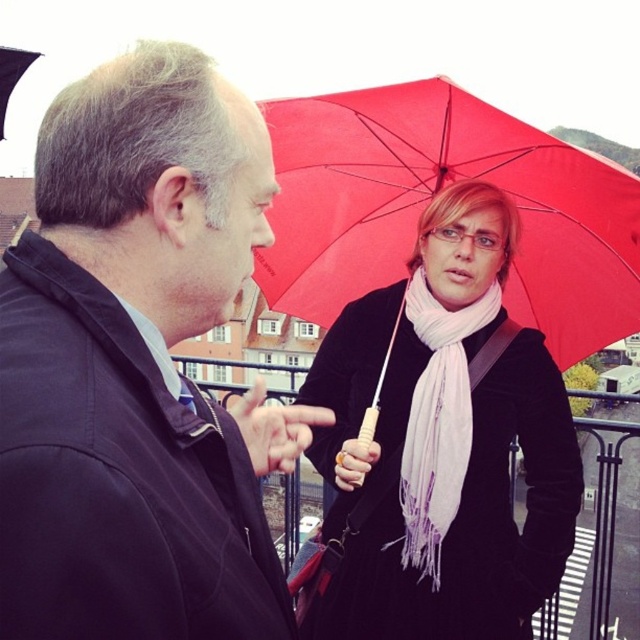
Describe the element at coordinates (138, 368) in the screenshot. This screenshot has width=640, height=640. I see `matte black jacket at left` at that location.

Who is positioned more to the left, matte black jacket at left or white soft scarf at center?

matte black jacket at left

Which is in front, point (8, 333) or point (451, 333)?

Positioned in front is point (8, 333).

At what (x,y) coordinates should I click in order to perform the action: click on matte black jacket at left. Please return your answer as a coordinate pair (x, y). Looking at the image, I should click on (138, 368).

Is pink scarf at upper right to the right of white soft scarf at center from the viewer's perspective?

Incorrect, pink scarf at upper right is not on the right side of white soft scarf at center.

Measure the distance between pink scarf at upper right and camera.

They are 47.09 meters apart.

At what (x,y) coordinates should I click in order to perform the action: click on pink scarf at upper right. Please return your answer as a coordinate pair (x, y). This screenshot has width=640, height=640. Looking at the image, I should click on (440, 445).

Is point (317, 241) in front of point (456, 449)?

No, it is not.

Is red matte umbrella at upper right behind white soft scarf at center?

No, it is in front of white soft scarf at center.

Between point (572, 339) and point (422, 387), which one is positioned in front?

Point (422, 387) is in front.

Where is `red matte umbrella at upper right`? Image resolution: width=640 pixels, height=640 pixels. red matte umbrella at upper right is located at coordinates (436, 196).